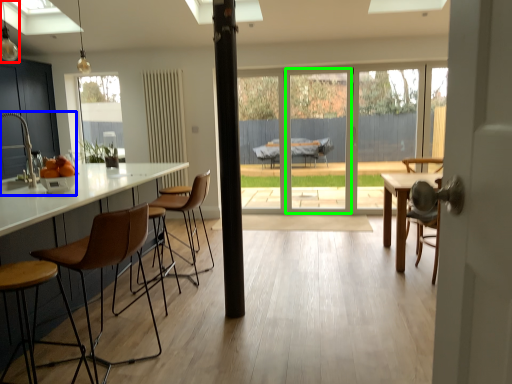
Question: Which object is the closest to the light fixture (highlighted by a red box)? Choose among these: sink (highlighted by a blue box) or screen door (highlighted by a green box).

Choices:
 (A) sink
 (B) screen door

Answer: (A)